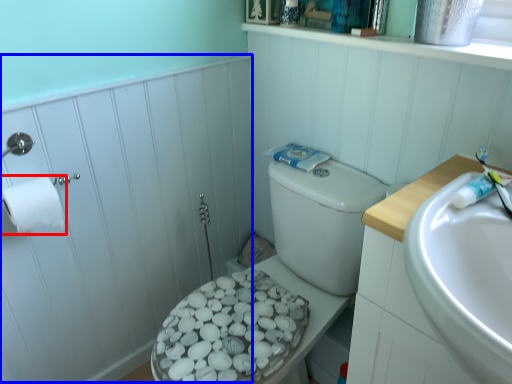
Question: Which object appears closest to the camera in this image, toilet paper (highlighted by a red box) or side (highlighted by a blue box)?

Choices:
 (A) toilet paper
 (B) side

Answer: (B)